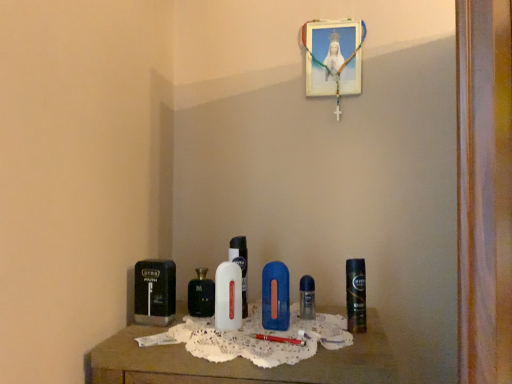
What is the approximate width of wooden table at center?

14.14 inches.

Find the location of a particular element. white glossy bottle at center, positioned as the 2th perfume in left-to-right order is located at coordinates (228, 296).

Where is `matte black perfume at center, which is the fourth perfume from front to back`? This screenshot has height=384, width=512. matte black perfume at center, which is the fourth perfume from front to back is located at coordinates (201, 295).

Where is `wooden table at center`? This screenshot has height=384, width=512. wooden table at center is located at coordinates (241, 363).

Measure the distance between black plastic razor at left, the first personal care when ordered from left to right, and wooden picture frame at upper center.

30.25 inches.

Could wooden picture frame at upper center be considered to be inside black plastic razor at left, which is the 3th personal care from right to left?

No, wooden picture frame at upper center is not inside black plastic razor at left, which is the 3th personal care from right to left.

Could you tell me if black plastic razor at left, which is the 3th personal care from right to left, is facing wooden picture frame at upper center?

No, black plastic razor at left, which is the 3th personal care from right to left, is not turned towards wooden picture frame at upper center.

From a real-world perspective, who is located higher, black plastic razor at left, which is the 3th personal care from right to left, or wooden picture frame at upper center?

In real-world perspective, wooden picture frame at upper center is above.

Considering the positions of point (194, 307) and point (339, 89), is point (194, 307) closer or farther from the camera than point (339, 89)?

Point (194, 307) is positioned closer to the camera compared to point (339, 89).

Looking at this image, is matte black perfume at center, which is the 1th perfume from left to right, not close to wooden picture frame at upper center?

No, there isn't a large distance between matte black perfume at center, which is the 1th perfume from left to right, and wooden picture frame at upper center.

Is matte black perfume at center, which appears as the first perfume when viewed from the back, oriented towards wooden picture frame at upper center?

No, matte black perfume at center, which appears as the first perfume when viewed from the back, does not turn towards wooden picture frame at upper center.

From a real-world perspective, does matte black perfume at center, positioned as the 4th perfume in right-to-left order, stand above wooden picture frame at upper center?

No.

Is white plastic bottle at center, the third perfume when ordered from back to front, oriented towards shiny metallic deodorant at right, acting as the 3th personal care starting from the left?

No, white plastic bottle at center, the third perfume when ordered from back to front, is not oriented towards shiny metallic deodorant at right, acting as the 3th personal care starting from the left.

Between white plastic bottle at center, the 2th perfume in the right-to-left sequence, and shiny metallic deodorant at right, placed as the first personal care when sorted from right to left, which one has larger size?

Bigger between the two is shiny metallic deodorant at right, placed as the first personal care when sorted from right to left.

Image resolution: width=512 pixels, height=384 pixels. Identify the location of the 1st personal care below the white plastic bottle at center, which appears as the 2th perfume when viewed from the front (from the image's perspective). 356,295.

From a real-world perspective, is white plastic bottle at center, which appears as the 2th perfume when viewed from the front, positioned over shiny metallic deodorant at right, acting as the 3th personal care starting from the left, based on gravity?

Correct, in the physical world, white plastic bottle at center, which appears as the 2th perfume when viewed from the front, is higher than shiny metallic deodorant at right, acting as the 3th personal care starting from the left.

Considering the sizes of objects matte black perfume at center, which appears as the first perfume when viewed from the back, and clear plastic perfume at center, the fourth perfume from the left, in the image provided, who is smaller, matte black perfume at center, which appears as the first perfume when viewed from the back, or clear plastic perfume at center, the fourth perfume from the left,?

With smaller size is clear plastic perfume at center, the fourth perfume from the left.

From a real-world perspective, which object stands above the other?

matte black perfume at center, which is the fourth perfume from front to back, from a real-world perspective.

Can you tell me how much matte black perfume at center, which is the 1th perfume from left to right, and clear plastic perfume at center, the 3th perfume positioned from the front, differ in facing direction?

0.00662 degrees separate the facing orientations of matte black perfume at center, which is the 1th perfume from left to right, and clear plastic perfume at center, the 3th perfume positioned from the front.

Consider the image. From the image's perspective, is matte black perfume at center, positioned as the 4th perfume in right-to-left order, located beneath clear plastic perfume at center, which is the 2th perfume from back to front?

Actually, matte black perfume at center, positioned as the 4th perfume in right-to-left order, appears above clear plastic perfume at center, which is the 2th perfume from back to front, in the image.

Would you say white glossy bottle at center, the third perfume positioned from the right, is inside or outside wooden picture frame at upper center?

The correct answer is: outside.

Is white glossy bottle at center, the third perfume positioned from the right, smaller than wooden picture frame at upper center?

Correct, white glossy bottle at center, the third perfume positioned from the right, occupies less space than wooden picture frame at upper center.

Considering the points (230, 267) and (322, 60), which point is in front, point (230, 267) or point (322, 60)?

Point (230, 267)

Would you say white glossy bottle at center, positioned as the 2th perfume in left-to-right order, is inside or outside black plastic razor at left, which is the 3th personal care from right to left?

white glossy bottle at center, positioned as the 2th perfume in left-to-right order, exists outside the volume of black plastic razor at left, which is the 3th personal care from right to left.

Does white glossy bottle at center, the third perfume positioned from the right, lie behind black plastic razor at left, which is the 3th personal care from right to left?

No, white glossy bottle at center, the third perfume positioned from the right, is in front of black plastic razor at left, which is the 3th personal care from right to left.

From the image's perspective, between white glossy bottle at center, positioned as the 2th perfume in left-to-right order, and black plastic razor at left, which is the 3th personal care from right to left, which one is located above?

white glossy bottle at center, positioned as the 2th perfume in left-to-right order, is shown above in the image.

Are white glossy bottle at center, the third perfume positioned from the right, and black plastic razor at left, which is the 3th personal care from right to left, making contact?

white glossy bottle at center, the third perfume positioned from the right, and black plastic razor at left, which is the 3th personal care from right to left, are clearly separated.

Where is `perfume that is the 1st object located below the wooden picture frame at upper center (from the image's perspective)`? perfume that is the 1st object located below the wooden picture frame at upper center (from the image's perspective) is located at coordinates (240, 266).

Is white plastic bottle at center, which appears as the 2th perfume when viewed from the front, facing towards wooden picture frame at upper center?

No.

Does point (234, 252) come farther from viewer compared to point (319, 27)?

That is False.

Measure the distance from white plastic bottle at center, the 2th perfume in the right-to-left sequence, to wooden picture frame at upper center.

white plastic bottle at center, the 2th perfume in the right-to-left sequence, is 24.01 inches away from wooden picture frame at upper center.

Locate an element on the screen. The image size is (512, 384). personal care that is the 2nd object directly below the wooden picture frame at upper center (from a real-world perspective) is located at coordinates (155, 292).

Where is `picture frame on the right of matte black perfume at center, which appears as the first perfume when viewed from the back`? The width and height of the screenshot is (512, 384). picture frame on the right of matte black perfume at center, which appears as the first perfume when viewed from the back is located at coordinates (333, 57).

From the image, which object appears to be farther from matte black perfume at center, positioned as the 4th perfume in right-to-left order, clear plastic perfume at center, which is the 2th perfume from back to front, or white glossy bottle at center, the 4th perfume when ordered from back to front?

clear plastic perfume at center, which is the 2th perfume from back to front, lies further to matte black perfume at center, positioned as the 4th perfume in right-to-left order, than the other object.

Estimate the real-world distances between objects in this image. Which object is further from wooden picture frame at upper center, shiny metallic deodorant at right, acting as the 3th personal care starting from the left, or clear plastic perfume at center, the 3th perfume positioned from the front?

Based on the image, clear plastic perfume at center, the 3th perfume positioned from the front, appears to be further to wooden picture frame at upper center.

When comparing their distances from black plastic razor at left, the first personal care when ordered from left to right, does white plastic bottle at center, which appears as the 2th perfume when viewed from the front, or wooden picture frame at upper center seem closer?

The object closer to black plastic razor at left, the first personal care when ordered from left to right, is white plastic bottle at center, which appears as the 2th perfume when viewed from the front.

When comparing their distances from shiny metallic deodorant at right, acting as the 3th personal care starting from the left, does white plastic bottle at center, which appears as the 2th perfume when viewed from the front, or white glossy bottle at center, the third perfume positioned from the right, seem closer?

Based on the image, white glossy bottle at center, the third perfume positioned from the right, appears to be nearer to shiny metallic deodorant at right, acting as the 3th personal care starting from the left.

Which object lies further to the anchor point blue plastic razor at center, arranged as the second personal care when viewed from the right, shiny metallic deodorant at right, placed as the first personal care when sorted from right to left, or clear plastic perfume at center, the fourth perfume from the left?

The object further to blue plastic razor at center, arranged as the second personal care when viewed from the right, is shiny metallic deodorant at right, placed as the first personal care when sorted from right to left.

When comparing their distances from shiny metallic deodorant at right, placed as the first personal care when sorted from right to left, does white plastic bottle at center, acting as the third perfume starting from the left, or wooden table at center seem further?

The object further to shiny metallic deodorant at right, placed as the first personal care when sorted from right to left, is white plastic bottle at center, acting as the third perfume starting from the left.

Which object lies further to the anchor point matte black perfume at center, which appears as the first perfume when viewed from the back, wooden table at center or blue plastic razor at center, the 2th personal care from the left?

Among the two, wooden table at center is located further to matte black perfume at center, which appears as the first perfume when viewed from the back.

Looking at the image, which one is located further to black plastic razor at left, the first personal care when ordered from left to right, white plastic bottle at center, acting as the third perfume starting from the left, or white glossy bottle at center, the 4th perfume when ordered from back to front?

white plastic bottle at center, acting as the third perfume starting from the left.

Find the location of a particular element. The image size is (512, 384). personal care between white glossy bottle at center, marked as the 1th perfume in a front-to-back arrangement, and clear plastic perfume at center, the 3th perfume positioned from the front, from left to right is located at coordinates (275, 297).

This screenshot has height=384, width=512. I want to click on personal care between wooden picture frame at upper center and white glossy bottle at center, the 4th perfume when ordered from back to front, vertically, so click(x=356, y=295).

At what (x,y) coordinates should I click in order to perform the action: click on personal care between black plastic razor at left, the first personal care when ordered from left to right, and clear plastic perfume at center, which is the 2th perfume from back to front, in the horizontal direction. Please return your answer as a coordinate pair (x, y). Image resolution: width=512 pixels, height=384 pixels. Looking at the image, I should click on (275, 297).

Where is `perfume between blue plastic razor at center, arranged as the second personal care when viewed from the right, and shiny metallic deodorant at right, placed as the first personal care when sorted from right to left`? perfume between blue plastic razor at center, arranged as the second personal care when viewed from the right, and shiny metallic deodorant at right, placed as the first personal care when sorted from right to left is located at coordinates (307, 297).